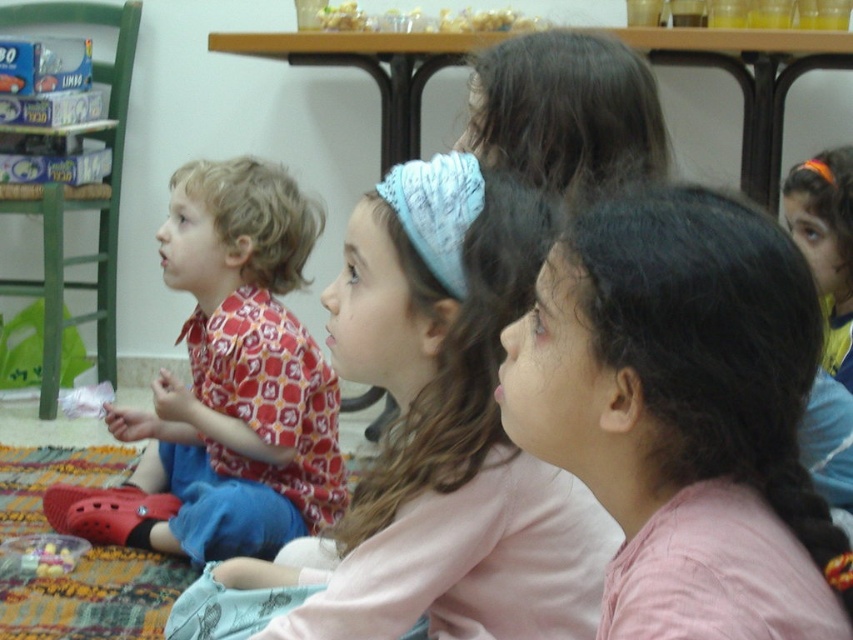
Who is taller, pink fabric at center or plastic toy at lower left?

Standing taller between the two is pink fabric at center.

Can you confirm if pink fabric at center is positioned above plastic toy at lower left?

Indeed, pink fabric at center is positioned over plastic toy at lower left.

Is point (555, 330) farther from camera compared to point (28, 557)?

No, (555, 330) is in front of (28, 557).

Image resolution: width=853 pixels, height=640 pixels. Find the location of `pink fabric at center`. pink fabric at center is located at coordinates (683, 413).

Who is more forward, (x=697, y=433) or (x=212, y=371)?

Positioned in front is point (x=697, y=433).

Does pink fabric at center appear under red patterned shirt at left?

Actually, pink fabric at center is above red patterned shirt at left.

Locate an element on the screen. The image size is (853, 640). pink fabric at center is located at coordinates (683, 413).

Find the location of a particular element. The width and height of the screenshot is (853, 640). pink fabric at center is located at coordinates (683, 413).

Is point (323, 602) positioned after point (44, 554)?

No, it is in front of (44, 554).

What do you see at coordinates (444, 432) in the screenshot?
I see `light pink fabric headband at center` at bounding box center [444, 432].

At what (x,y) coordinates should I click in order to perform the action: click on light pink fabric headband at center. Please return your answer as a coordinate pair (x, y). The image size is (853, 640). Looking at the image, I should click on (444, 432).